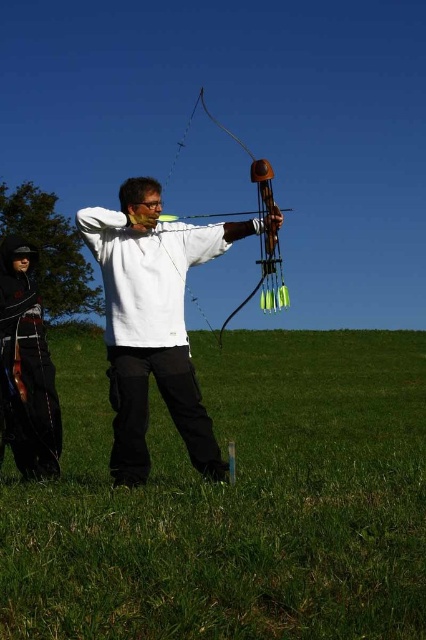
You are an archer standing in the green grass at center. You want to place your wooden bow at center on the ground. Will the bow be visible above the grass?

The green grass at center is taller than the wooden bow at center, so the bow will not be visible above the grass when placed on the ground.

You are a photographer planning to capture a wide shot of the archer and the person in the black leather jacket. Given that the camera can only accommodate objects up to the size of the white matte archer at center, will the black leather jacket at lower left fit into the frame?

The white matte archer at center is wider than the black leather jacket at lower left. Since the camera can accommodate the white matte archer at center, the black leather jacket at lower left will also fit into the frame as it is smaller in width.

You are a photographer wanting to capture the wooden bow at center and the green grass at center in the same frame. Which object should you focus on first to ensure both are in focus?

The green grass at center is in front of the wooden bow at center, so you should focus on the green grass at center first to ensure both are in focus.